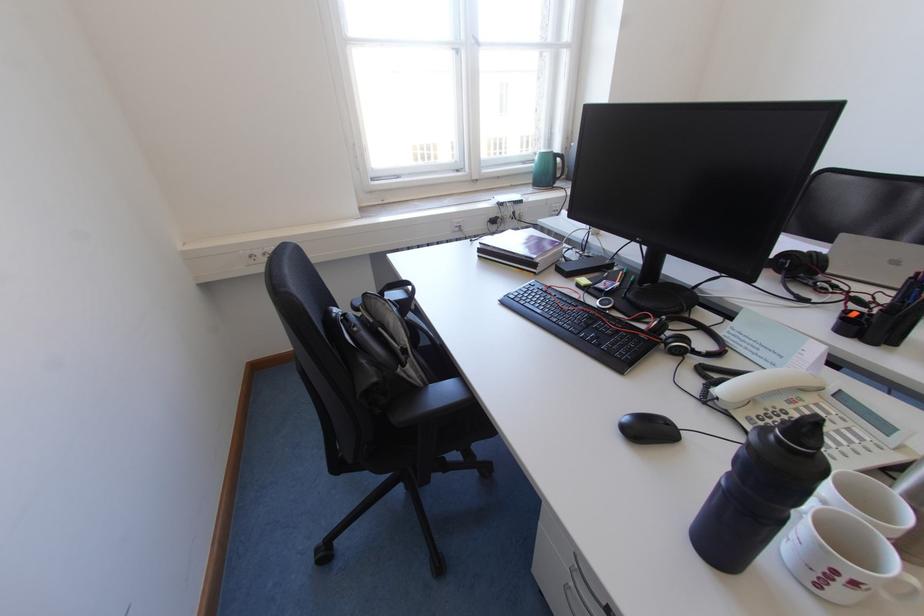
Where would you open the black bottle cap? Please return your answer as a coordinate pair (x, y).

(810, 428)